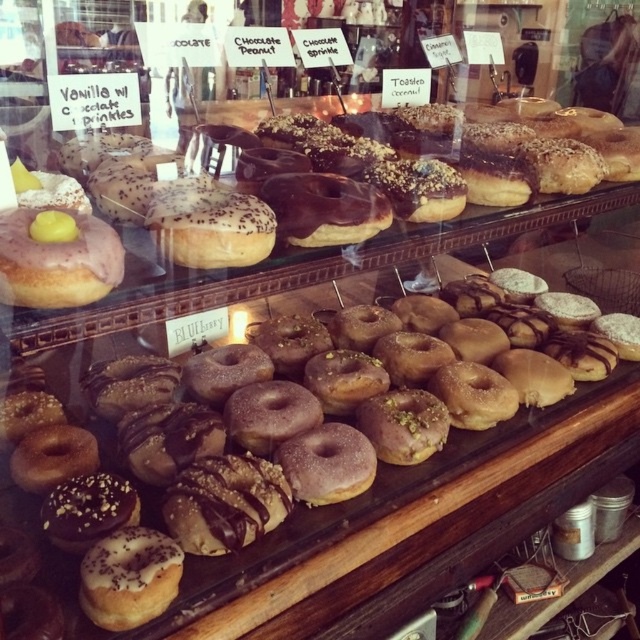
Question: Can you confirm if chocolate glaze donut at center is smaller than matte pink glazed donut at left?

Choices:
 (A) no
 (B) yes

Answer: (A)

Question: Which point is closer to the camera?

Choices:
 (A) chocolate glaze donut at center
 (B) matte pink glazed donut at left
 (C) matte white glazed donut at left

Answer: (B)

Question: Is chocolate glaze donut at center thinner than matte pink glazed donut at left?

Choices:
 (A) yes
 (B) no

Answer: (B)

Question: Considering the real-world distances, which object is farthest from the chocolate glaze donut at center?

Choices:
 (A) matte white glazed donut at left
 (B) matte pink glazed donut at left

Answer: (B)

Question: Which point appears farthest from the camera in this image?

Choices:
 (A) (244, 536)
 (B) (112, 268)
 (C) (163, 280)

Answer: (A)

Question: Is chocolate glaze donut at center positioned in front of matte white glazed donut at left?

Choices:
 (A) no
 (B) yes

Answer: (A)